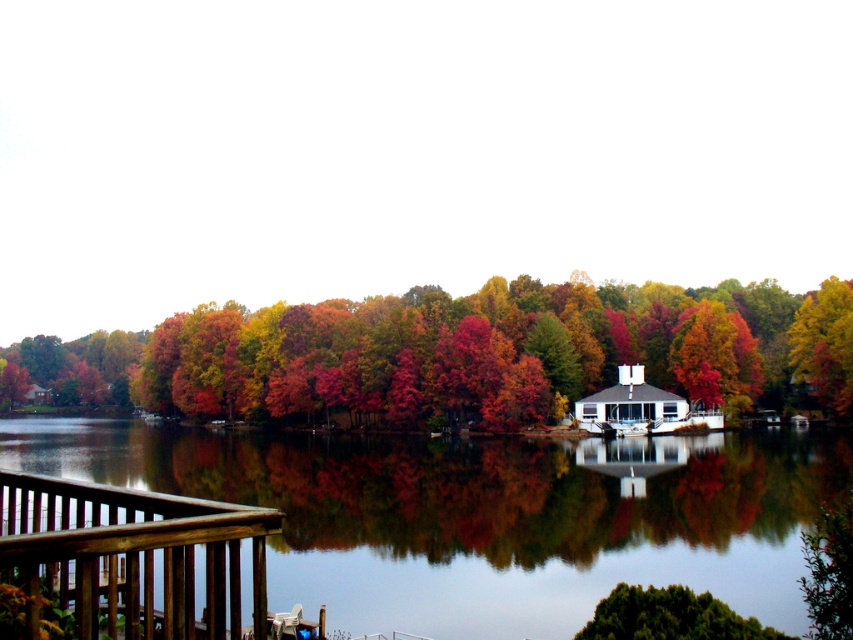
Question: Is smooth reflective water at center positioned at the back of autumn leaves at center?

Choices:
 (A) no
 (B) yes

Answer: (A)

Question: Among these objects, which one is nearest to the camera?

Choices:
 (A) autumn leaves at center
 (B) smooth reflective water at center

Answer: (B)

Question: Does smooth reflective water at center appear on the left side of brown wooden railing at lower left?

Choices:
 (A) yes
 (B) no

Answer: (A)

Question: Which of the following is the farthest from the observer?

Choices:
 (A) autumn leaves at center
 (B) brown wooden railing at lower left
 (C) smooth reflective water at center

Answer: (A)

Question: Which point appears closest to the camera in this image?

Choices:
 (A) (670, 333)
 (B) (165, 548)
 (C) (231, 474)

Answer: (B)

Question: Does smooth reflective water at center have a smaller size compared to autumn leaves at center?

Choices:
 (A) yes
 (B) no

Answer: (A)